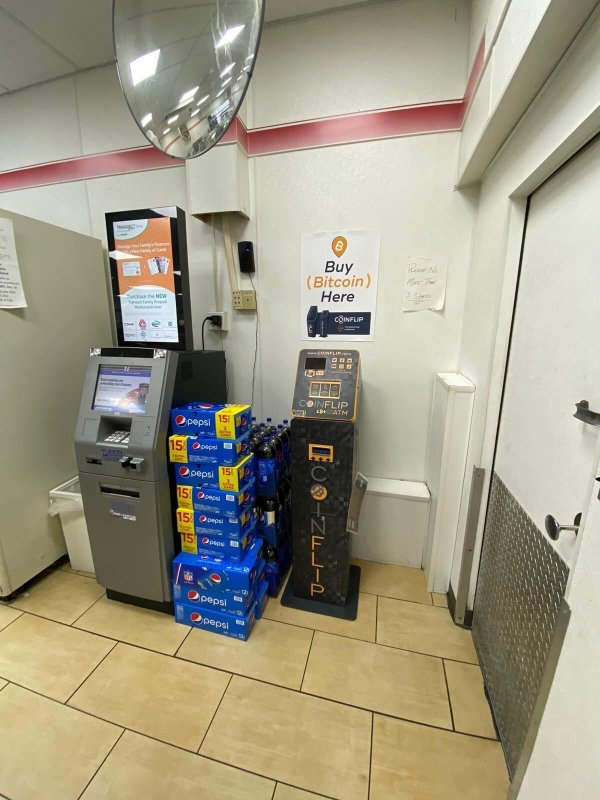
Find the location of a particular element. The height and width of the screenshot is (800, 600). wall is located at coordinates (375, 210).